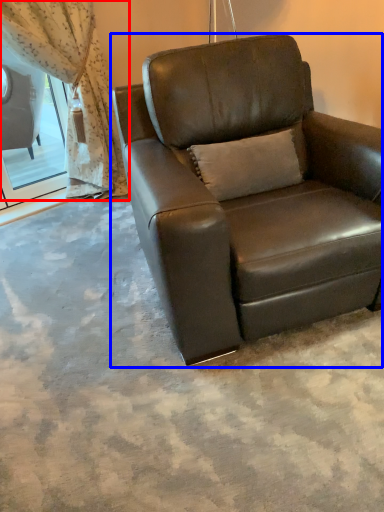
Question: Which object appears closest to the camera in this image, curtain (highlighted by a red box) or chair (highlighted by a blue box)?

Choices:
 (A) curtain
 (B) chair

Answer: (B)